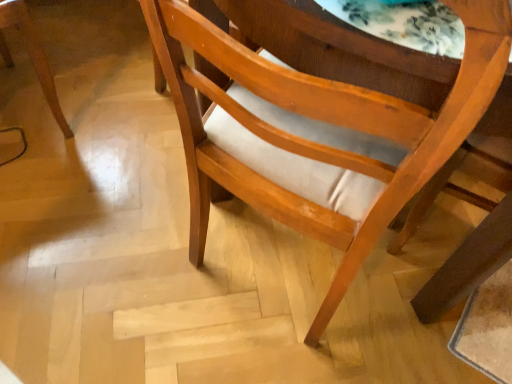
Where is `wooden chair at center`? The width and height of the screenshot is (512, 384). wooden chair at center is located at coordinates 316,134.

This screenshot has height=384, width=512. What do you see at coordinates (316, 134) in the screenshot?
I see `wooden chair at center` at bounding box center [316, 134].

What is the approximate height of wooden chair at center?

wooden chair at center is 86.10 centimeters in height.

The height and width of the screenshot is (384, 512). I want to click on wooden chair at center, so click(x=316, y=134).